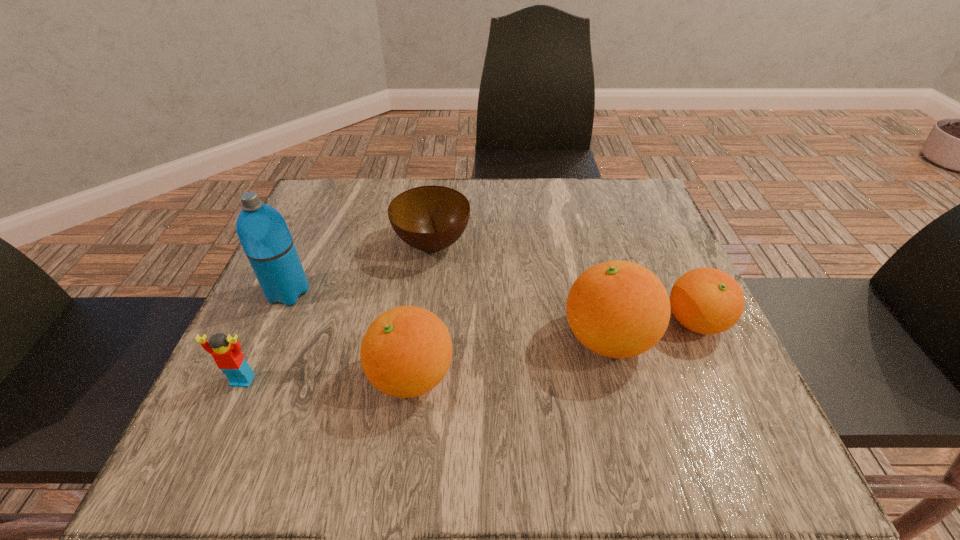
The image size is (960, 540). Identify the location of free space between the leftmost orange and the second orange from left to right. (510, 357).

Where is `free area in between the third tallest object and the tallest object`? free area in between the third tallest object and the tallest object is located at coordinates (350, 334).

Identify the location of free space between the second orange from left to right and the second tallest orange. This screenshot has height=540, width=960. (510, 357).

Locate an element on the screen. The image size is (960, 540). vacant space in between the bowl and the rightmost object is located at coordinates (564, 283).

Identify which object is located as the third nearest to the farthest object. Please provide its 2D coordinates. Your answer should be formatted as a tuple, i.e. [(x, y)], where the tuple contains the x and y coordinates of a point satisfying the conditions above.

[(619, 309)]

Locate which object ranks fifth in proximity to the tallest object. Please provide its 2D coordinates. Your answer should be formatted as a tuple, i.e. [(x, y)], where the tuple contains the x and y coordinates of a point satisfying the conditions above.

[(705, 300)]

Select which orange is the second closest to the rightmost object. Please provide its 2D coordinates. Your answer should be formatted as a tuple, i.e. [(x, y)], where the tuple contains the x and y coordinates of a point satisfying the conditions above.

[(406, 351)]

Identify which orange is the closest to the second tallest orange. Please provide its 2D coordinates. Your answer should be formatted as a tuple, i.e. [(x, y)], where the tuple contains the x and y coordinates of a point satisfying the conditions above.

[(619, 309)]

You are a GUI agent. You are given a task and a screenshot of the screen. Output one action in this format:
    pyautogui.click(x=<x>, y=<y>)
    Task: Click on the free point that satisfies the following two spatial constraints: 1. on the back side of the leftmost orange; 2. on the left side of the farthest object
    
    Given the screenshot: What is the action you would take?
    pyautogui.click(x=429, y=244)

This screenshot has width=960, height=540. I want to click on free space in the image that satisfies the following two spatial constraints: 1. on the front side of the rightmost orange; 2. on the left side of the thermos bottle, so click(276, 322).